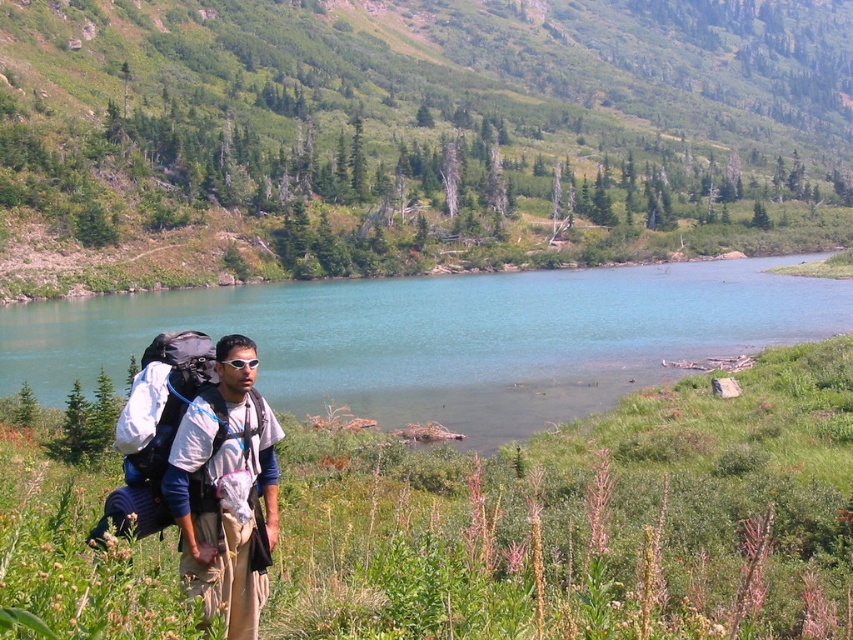
You are a hiker trying to decide which backpack to take for your trip. You see a white fabric backpack at center and a matte black backpack at lower left. Which one is closer to you?

The white fabric backpack at center is closer to you because it is in front of the matte black backpack at lower left.